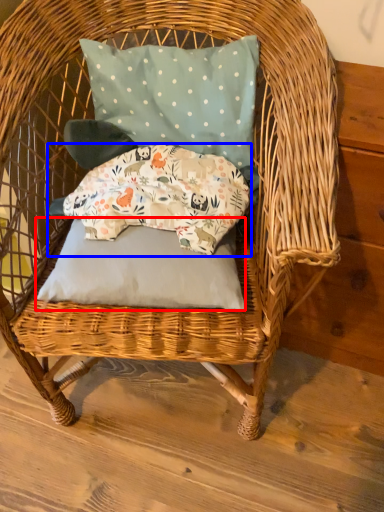
Question: Among these objects, which one is nearest to the camera, pillow (highlighted by a red box) or pillow (highlighted by a blue box)?

Choices:
 (A) pillow
 (B) pillow

Answer: (A)